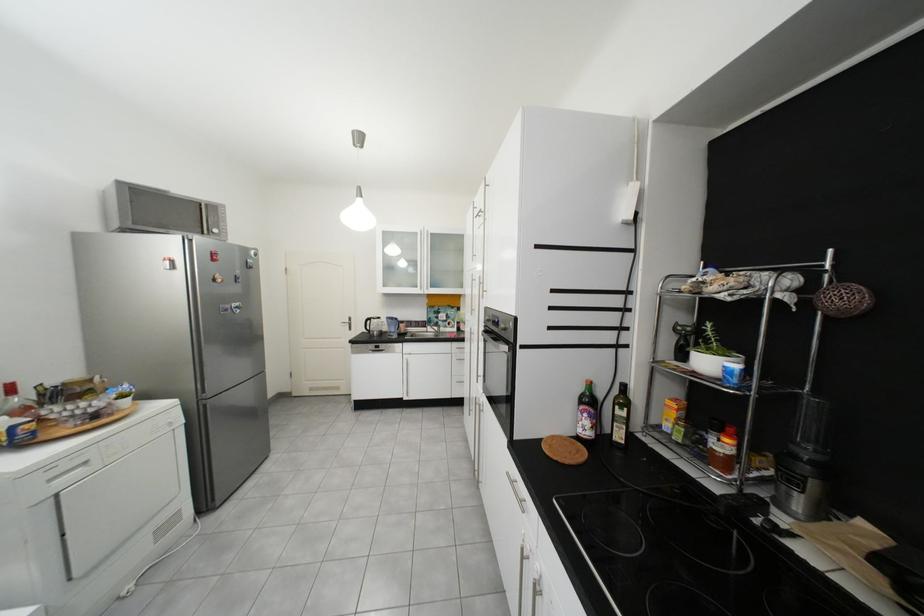
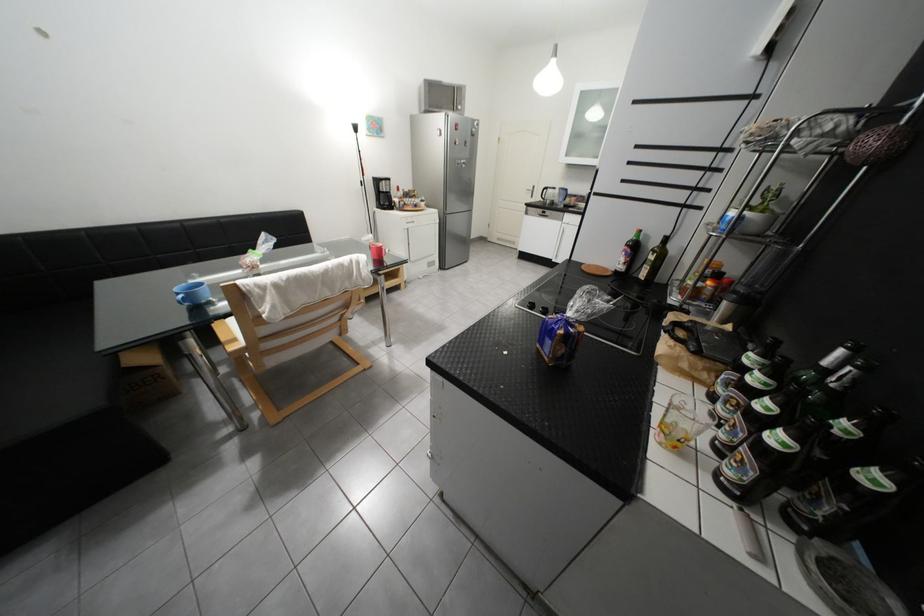
Locate, in the second image, the point that corresponds to point (361, 320) in the first image.

(545, 188)